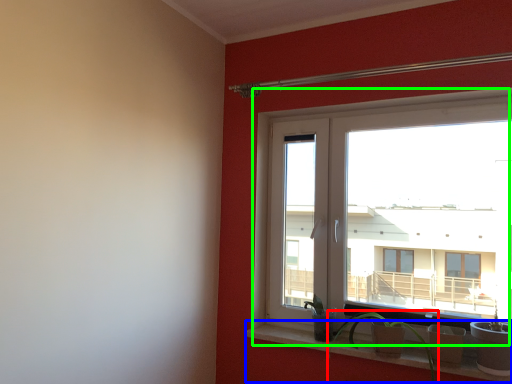
Question: Considering the real-world distances, which object is closest to houseplant (highlighted by a red box)? window sill (highlighted by a blue box) or window (highlighted by a green box).

Choices:
 (A) window sill
 (B) window

Answer: (A)